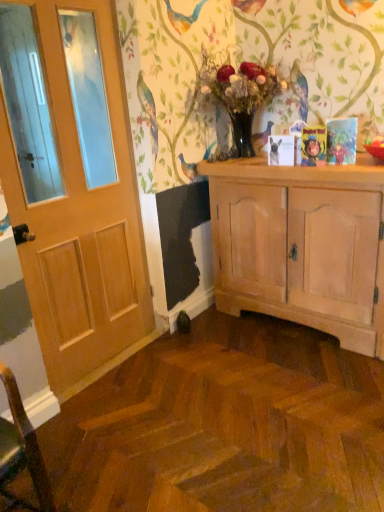
Question: Is translucent glass vase at center inside the boundaries of matte white dog at center, or outside?

Choices:
 (A) outside
 (B) inside

Answer: (A)

Question: From a real-world perspective, relative to matte white dog at center, is translucent glass vase at center vertically above or below?

Choices:
 (A) below
 (B) above

Answer: (B)

Question: Which of these objects is positioned closest to the wooden door at left?

Choices:
 (A) light wood cabinet at center
 (B) matte white dog at center
 (C) translucent glass vase at center
 (D) cartoon character book at upper right

Answer: (A)

Question: Based on their relative distances, which object is farther from the translucent glass vase at center?

Choices:
 (A) cartoon character book at upper right
 (B) light wood cabinet at center
 (C) wooden door at left
 (D) matte white dog at center

Answer: (C)